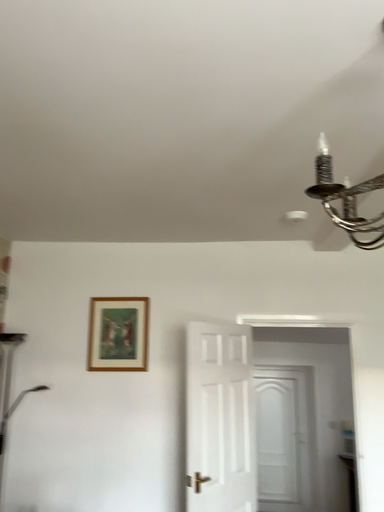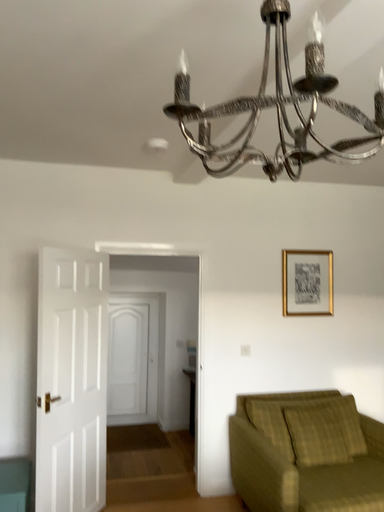
Question: How did the camera likely rotate when shooting the video?

Choices:
 (A) rotated right
 (B) rotated left

Answer: (A)